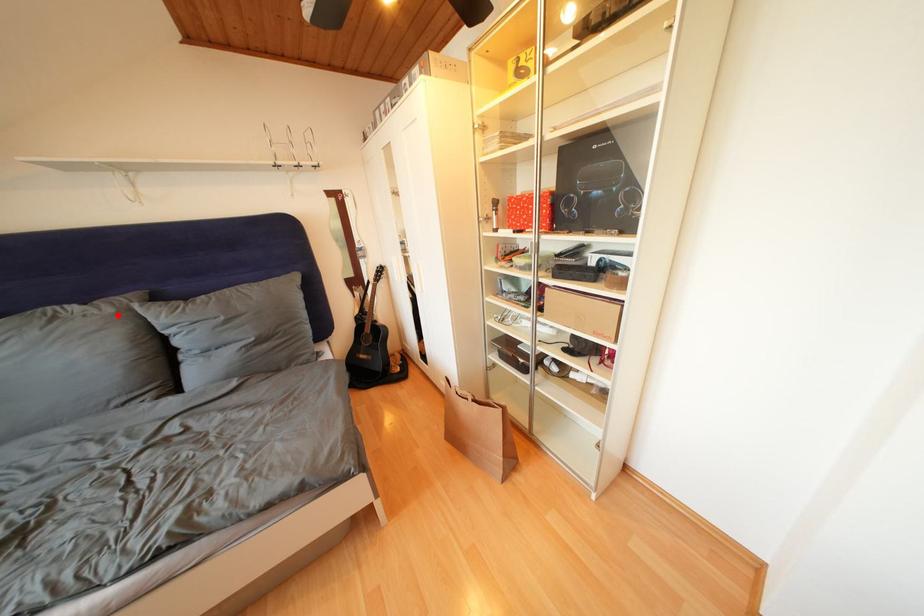
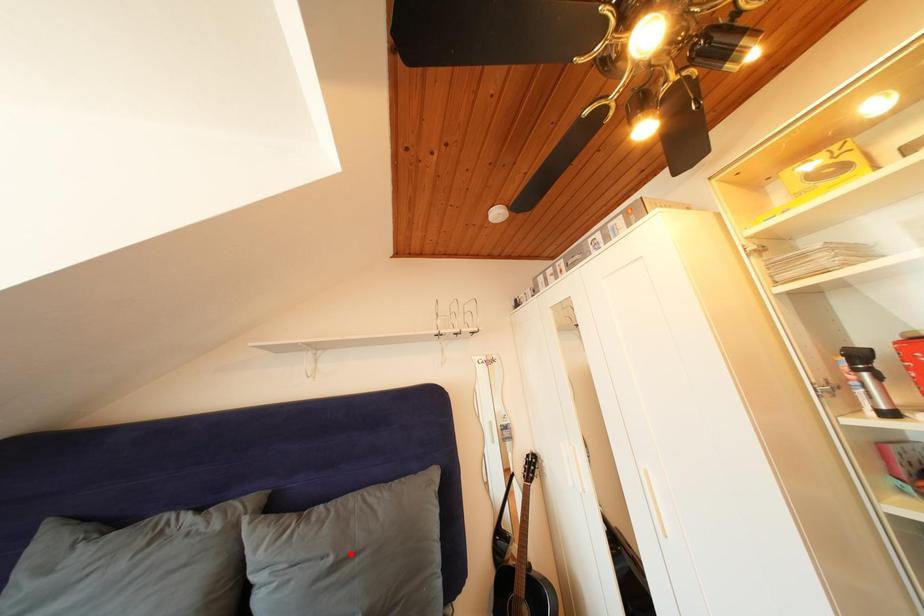
I am providing you with two images of the same scene from different viewpoints. A red point is marked on the first image and another point is marked on the second image. Is the marked point in image1 the same physical position as the marked point in image2?

No